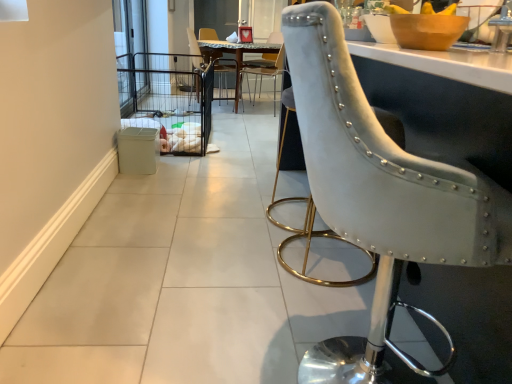
The height and width of the screenshot is (384, 512). Identify the location of vacant area that is in front of white plastic trash bin at lower left. (137, 173).